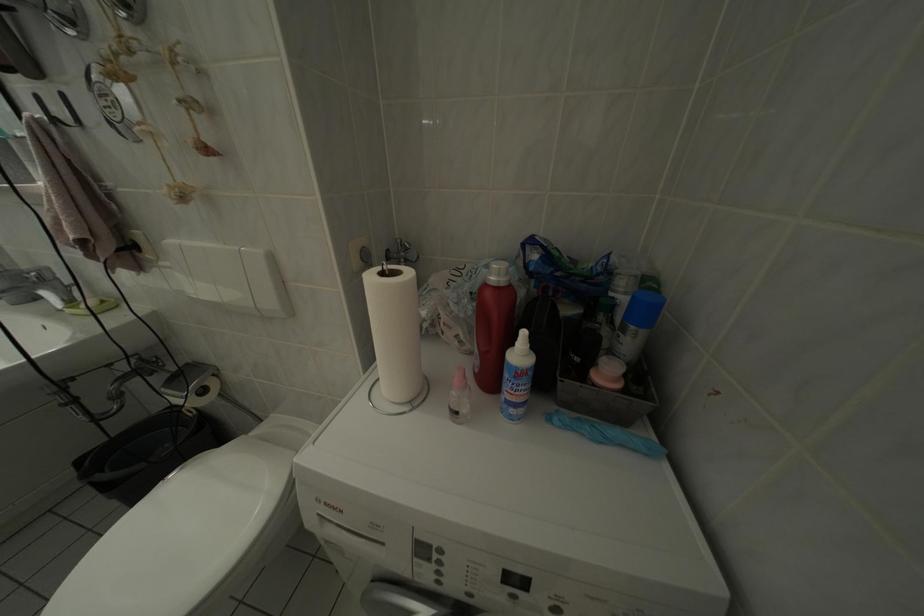
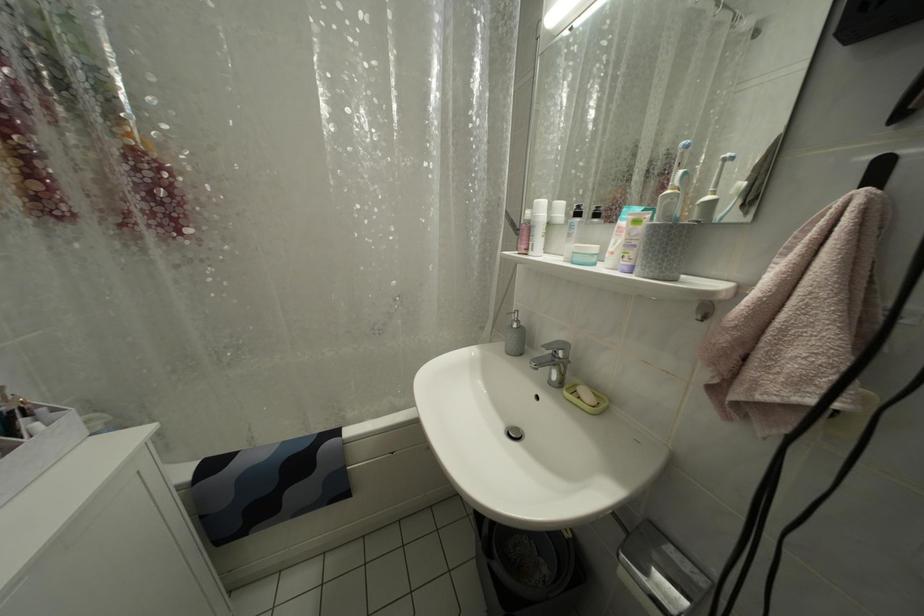
Question: The camera is either moving clockwise (left) or counter-clockwise (right) around the object. The first image is from the beginning of the video and the second image is from the end. Is the camera moving left or right when shooting the video?

Choices:
 (A) Left
 (B) Right

Answer: (B)